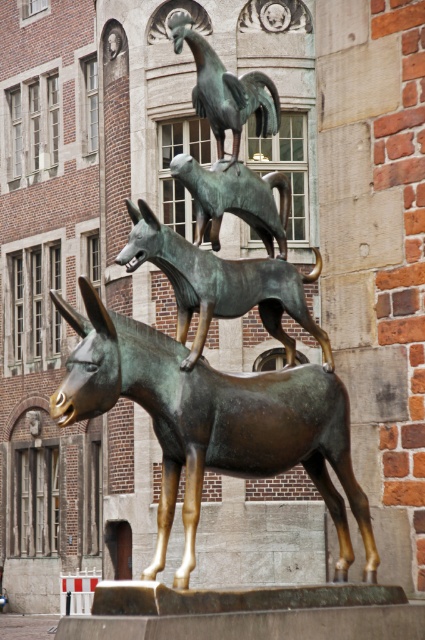
Question: Among these points, which one is nearest to the camera?

Choices:
 (A) (218, 186)
 (B) (57, 406)

Answer: (B)

Question: Is bronze donkey at center below bronze rooster at upper center?

Choices:
 (A) no
 (B) yes

Answer: (B)

Question: Which point appears closest to the camera in this image?

Choices:
 (A) (336, 528)
 (B) (212, 246)
 (C) (249, 81)
 (D) (192, 353)

Answer: (D)

Question: Does bronze dog at center appear under bronze donkey at center?

Choices:
 (A) no
 (B) yes

Answer: (B)

Question: Which of the following is the closest to the observer?

Choices:
 (A) bronze/golden donkey at center
 (B) bronze donkey at center

Answer: (A)

Question: Can you confirm if bronze/golden donkey at center is wider than bronze rooster at upper center?

Choices:
 (A) no
 (B) yes

Answer: (B)